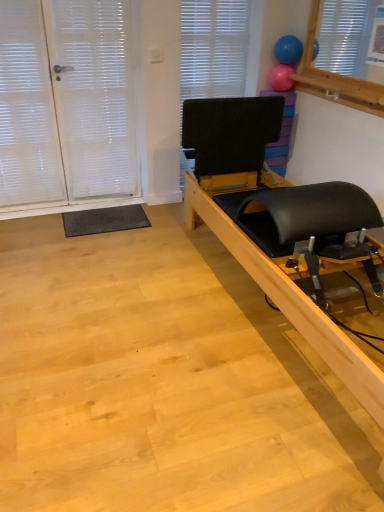
Identify the location of empty space that is ontop of pink rubber balloon at upper center, positioned as the second balloon in top-to-bottom order (from a real-world perspective). Image resolution: width=384 pixels, height=512 pixels. (290, 61).